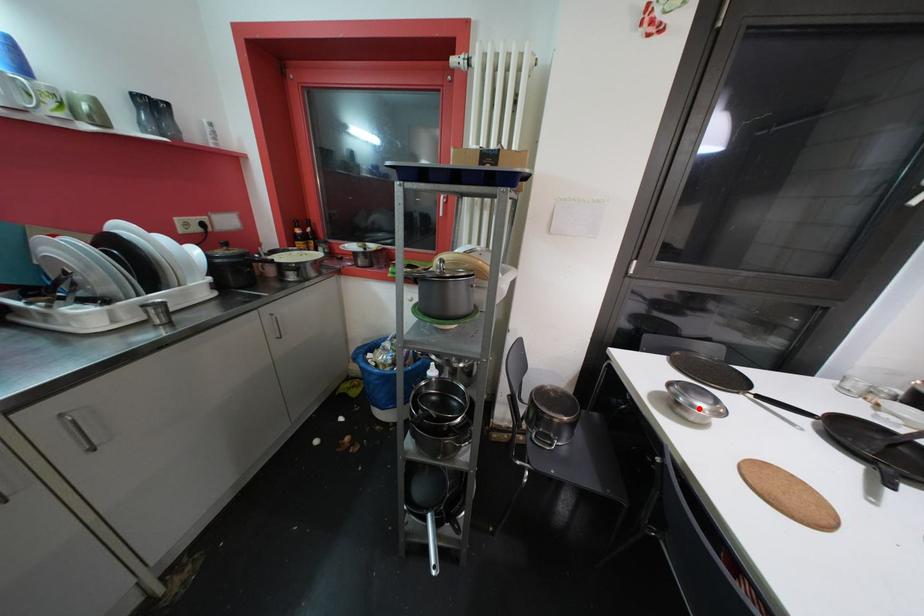
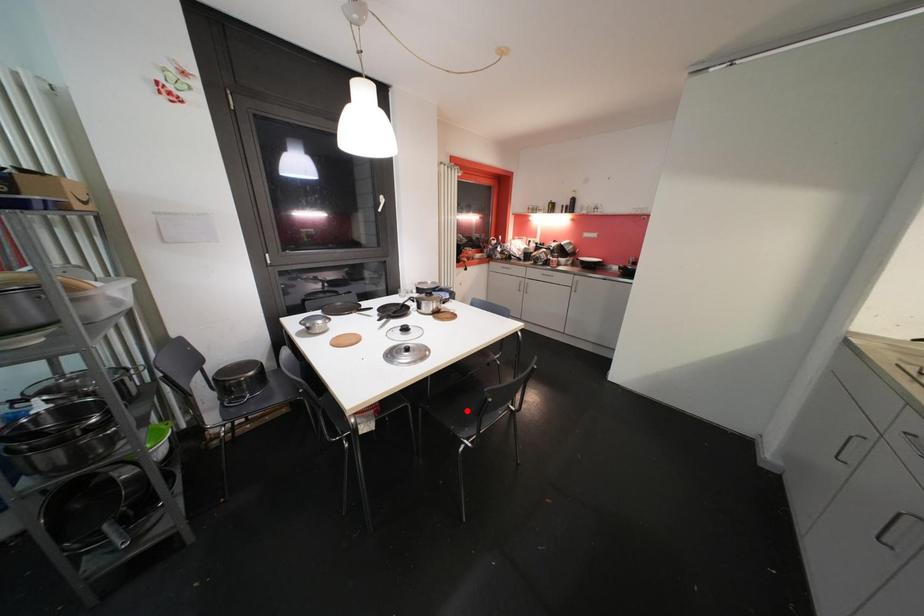
I am providing you with two images of the same scene from different viewpoints. A red point is marked on the first image and another point is marked on the second image. Is the red point in image1 aligned with the point shown in image2?

No